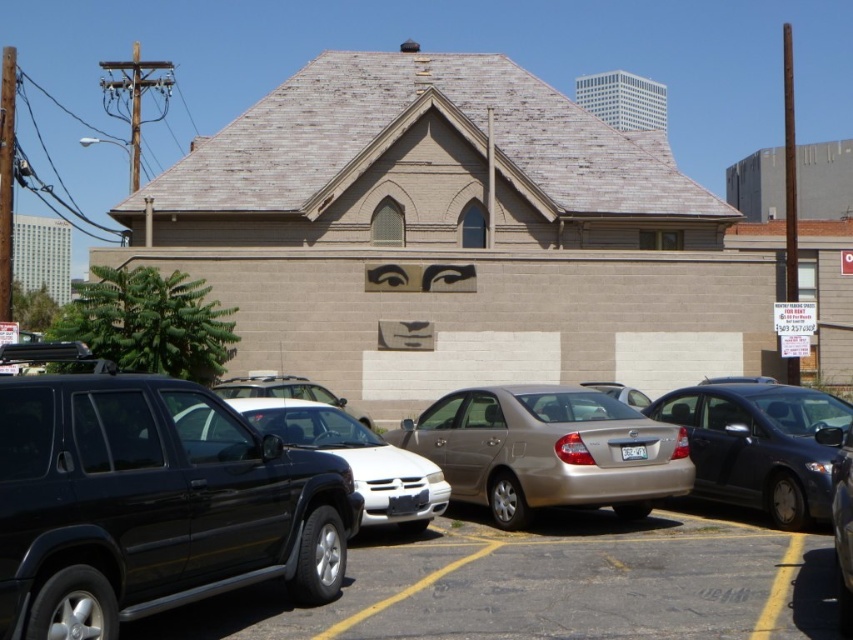
Is point (511, 545) farther from viewer compared to point (497, 460)?

No.

Which is in front, point (370, 580) or point (492, 413)?

Positioned in front is point (370, 580).

This screenshot has width=853, height=640. In order to click on black rubber tire at lower left in this screenshot , I will do `click(560, 586)`.

Does matte black suv at center come behind black matte suv at left?

Yes, it is.

Is matte black suv at center taller than black matte suv at left?

In fact, matte black suv at center may be shorter than black matte suv at left.

Is point (503, 561) farther from viewer compared to point (264, 497)?

Yes.

The width and height of the screenshot is (853, 640). Find the location of `matte black suv at center`. matte black suv at center is located at coordinates (538, 586).

Is black matte suv at left bigger than shiny black suv at center?

Yes, black matte suv at left is bigger than shiny black suv at center.

Does point (259, 499) come closer to viewer compared to point (410, 500)?

Yes, point (259, 499) is closer to viewer.

At what (x,y) coordinates should I click in order to perform the action: click on black matte suv at left. Please return your answer as a coordinate pair (x, y). This screenshot has height=640, width=853. Looking at the image, I should click on (149, 500).